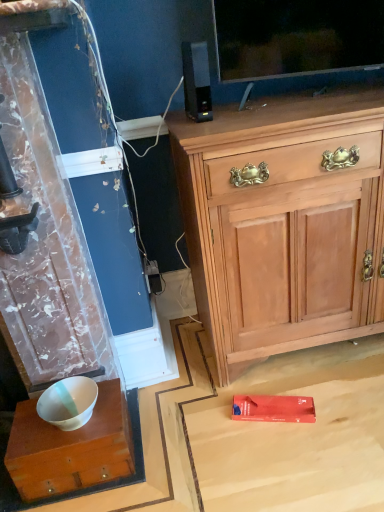
Question: From a real-world perspective, is light wood cabinet at upper right on top of black plastic speaker at upper center?

Choices:
 (A) yes
 (B) no

Answer: (B)

Question: Does light wood cabinet at upper right turn towards black plastic speaker at upper center?

Choices:
 (A) yes
 (B) no

Answer: (B)

Question: Is light wood cabinet at upper right taller than black plastic speaker at upper center?

Choices:
 (A) yes
 (B) no

Answer: (A)

Question: Would you say light wood cabinet at upper right contains black plastic speaker at upper center?

Choices:
 (A) no
 (B) yes

Answer: (A)

Question: Is light wood cabinet at upper right shorter than black plastic speaker at upper center?

Choices:
 (A) no
 (B) yes

Answer: (A)

Question: From the image's perspective, does light wood cabinet at upper right appear lower than black plastic speaker at upper center?

Choices:
 (A) no
 (B) yes

Answer: (B)

Question: From a real-world perspective, is black plastic speaker at upper center on light wood cabinet at upper right?

Choices:
 (A) yes
 (B) no

Answer: (A)

Question: Can you confirm if black plastic speaker at upper center is shorter than light wood cabinet at upper right?

Choices:
 (A) no
 (B) yes

Answer: (B)

Question: From a real-world perspective, is black plastic speaker at upper center beneath light wood cabinet at upper right?

Choices:
 (A) no
 (B) yes

Answer: (A)

Question: Is light wood cabinet at upper right completely or partially inside black plastic speaker at upper center?

Choices:
 (A) yes
 (B) no

Answer: (B)

Question: Can you confirm if black plastic speaker at upper center is wider than light wood cabinet at upper right?

Choices:
 (A) no
 (B) yes

Answer: (A)

Question: Is black plastic speaker at upper center taller than light wood cabinet at upper right?

Choices:
 (A) no
 (B) yes

Answer: (A)

Question: Is light wood cabinet at upper right not within white glossy wood desk at lower left?

Choices:
 (A) no
 (B) yes

Answer: (B)